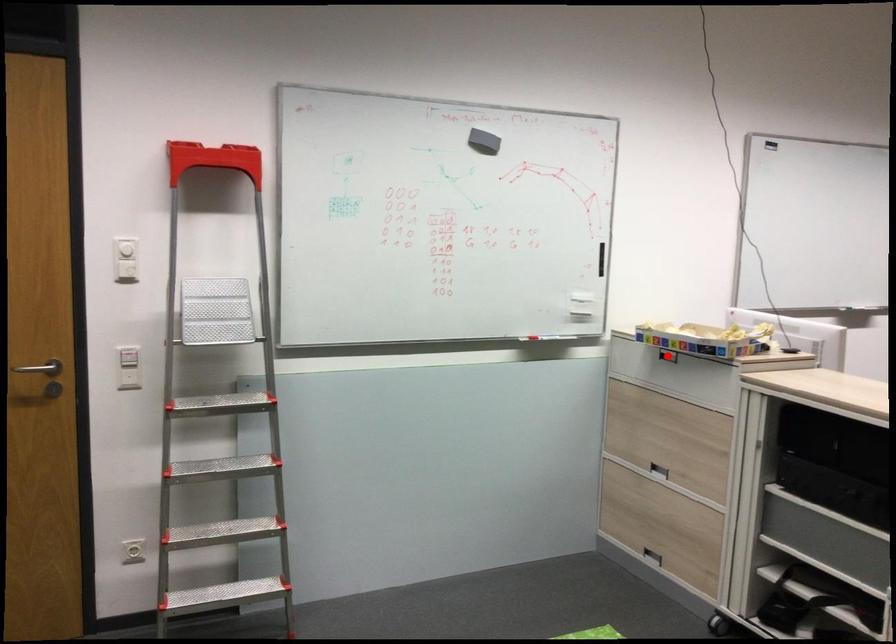
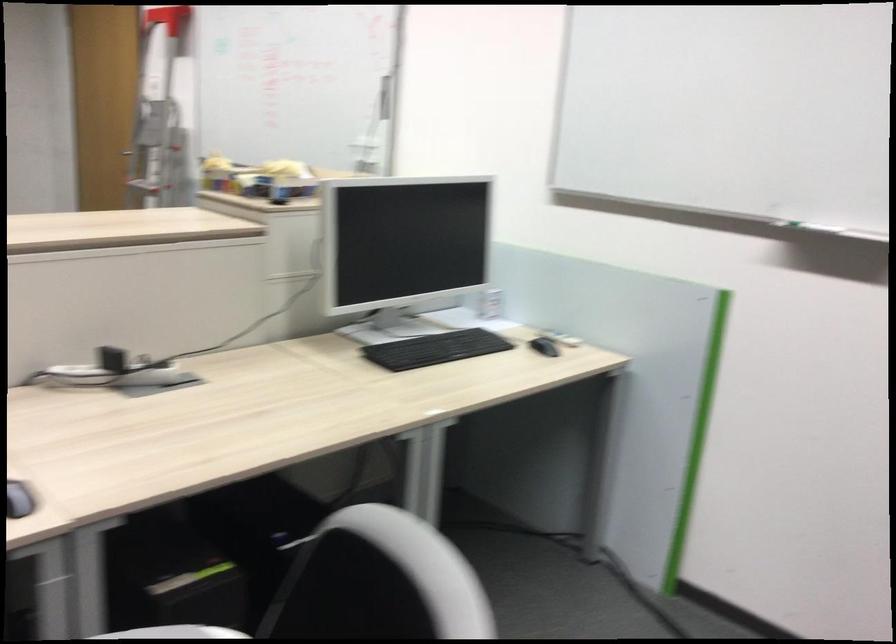
Question: I am providing you with two images of the same scene from different viewpoints. A red point is marked on the first image. Is the red point's position out of view in image 2?

Choices:
 (A) Yes
 (B) No

Answer: (A)